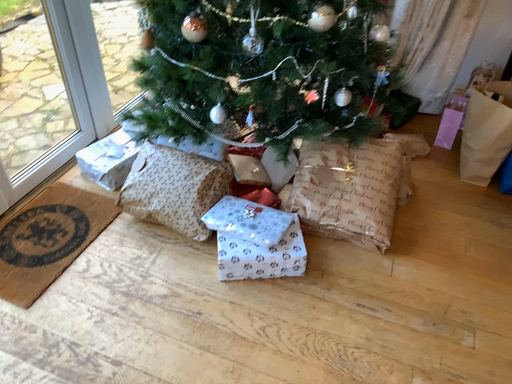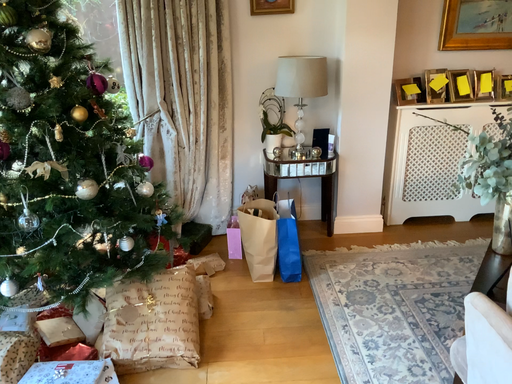
Question: How did the camera likely rotate when shooting the video?

Choices:
 (A) rotated upward
 (B) rotated downward

Answer: (A)